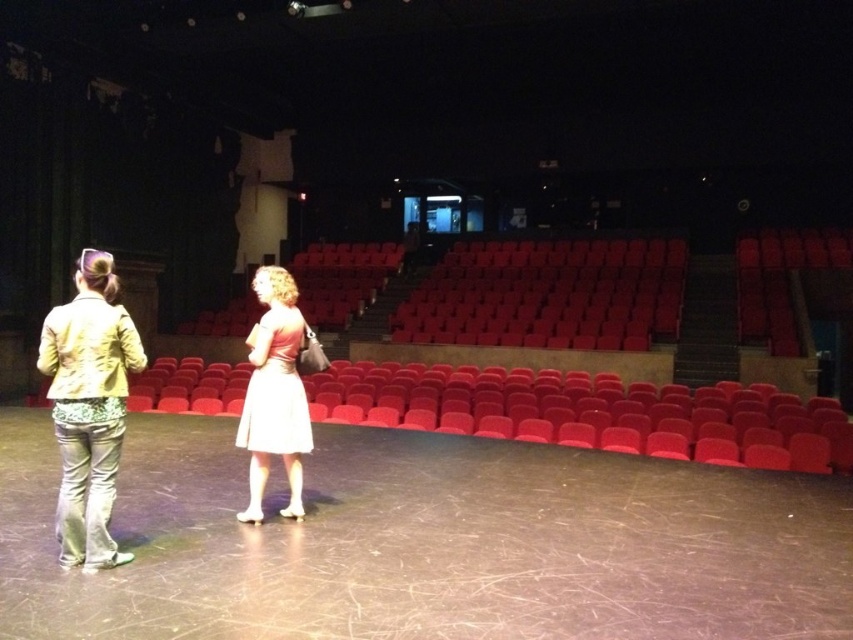
Question: Does light yellow fabric jacket at left have a greater width compared to white satin dress at center?

Choices:
 (A) no
 (B) yes

Answer: (B)

Question: Can you confirm if light yellow fabric jacket at left is positioned above white satin dress at center?

Choices:
 (A) yes
 (B) no

Answer: (B)

Question: Which point is farther to the camera?

Choices:
 (A) (79, 476)
 (B) (248, 436)

Answer: (B)

Question: Which point is closer to the camera?

Choices:
 (A) tap(279, 355)
 (B) tap(57, 330)

Answer: (B)

Question: Considering the relative positions of light yellow fabric jacket at left and white satin dress at center in the image provided, where is light yellow fabric jacket at left located with respect to white satin dress at center?

Choices:
 (A) right
 (B) left

Answer: (B)